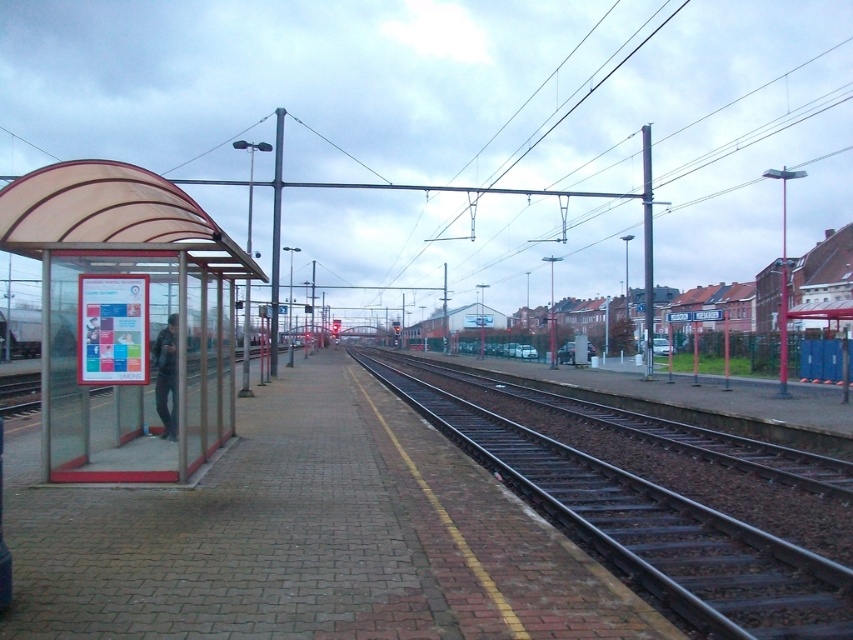
You are a pedestrian waiting at the translucent plastic bus stop at left and the dark gray jacket at left. Which object is closer to you?

The translucent plastic bus stop at left is closer to you since it is in front of the dark gray jacket at left.